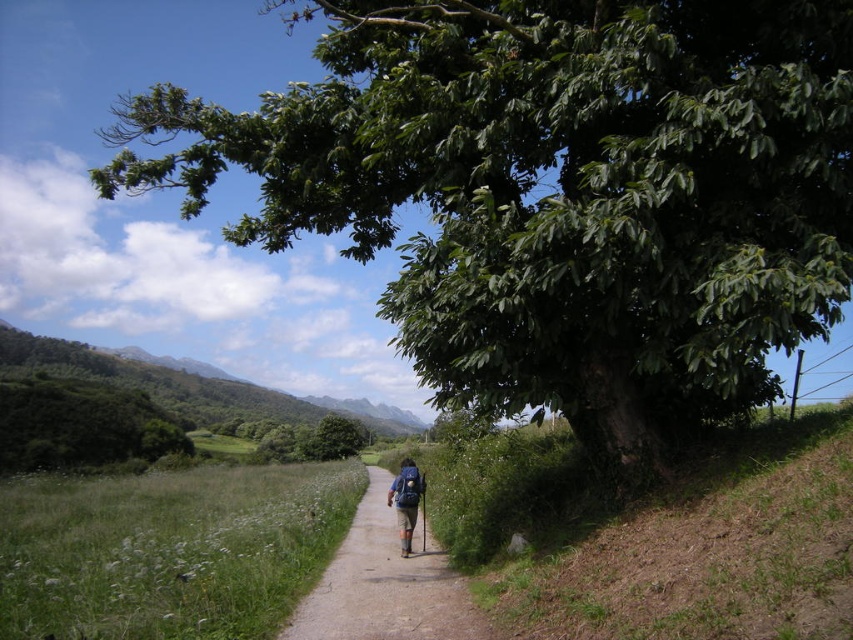
Question: Is brown dirt path at center further to camera compared to blue fabric backpack at center?

Choices:
 (A) yes
 (B) no

Answer: (B)

Question: Does green leafy tree at upper right have a larger size compared to brown dirt path at center?

Choices:
 (A) yes
 (B) no

Answer: (A)

Question: Is green leafy tree at upper right positioned at the back of brown dirt path at center?

Choices:
 (A) yes
 (B) no

Answer: (B)

Question: Which point is farther from the camera taking this photo?

Choices:
 (A) (456, 600)
 (B) (405, 497)
 (C) (624, 150)

Answer: (B)

Question: Considering the real-world distances, which object is closest to the green leafy tree at upper right?

Choices:
 (A) brown dirt path at center
 (B) blue fabric backpack at center

Answer: (A)

Question: Which of the following is the closest to the observer?

Choices:
 (A) brown dirt path at center
 (B) blue fabric backpack at center
 (C) green leafy tree at upper right

Answer: (C)